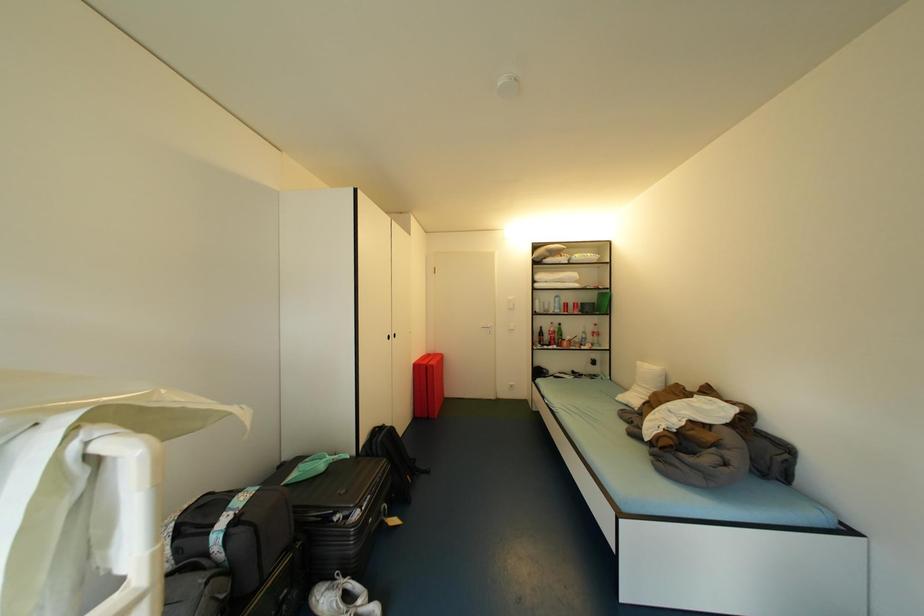
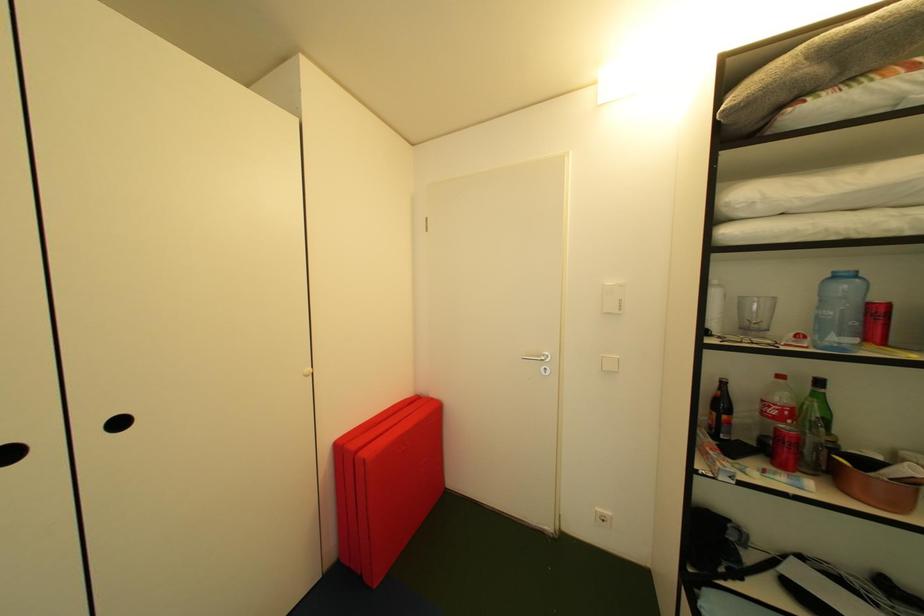
Question: The images are taken continuously from a first-person perspective. In which direction are you moving?

Choices:
 (A) Left
 (B) Right
 (C) Forward
 (D) Backward

Answer: (C)